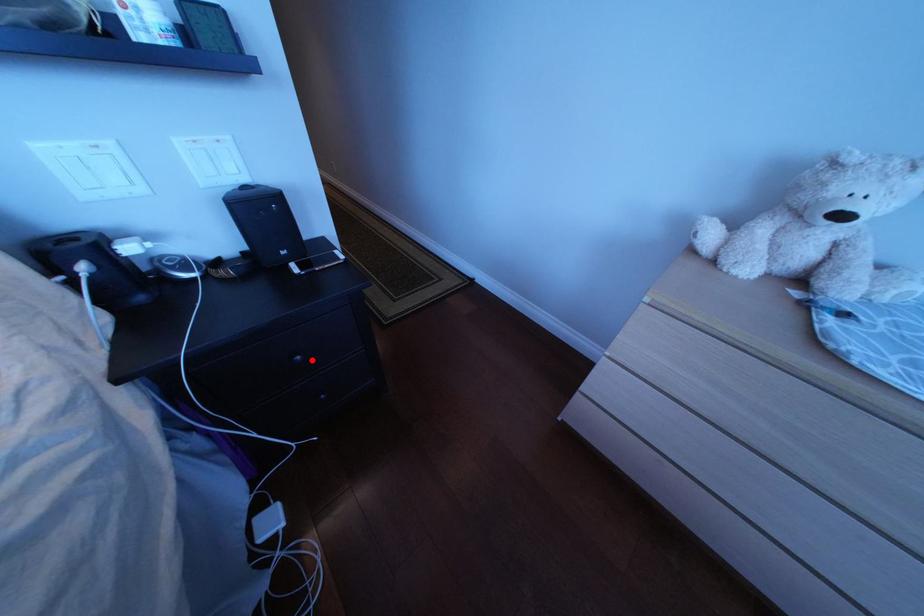
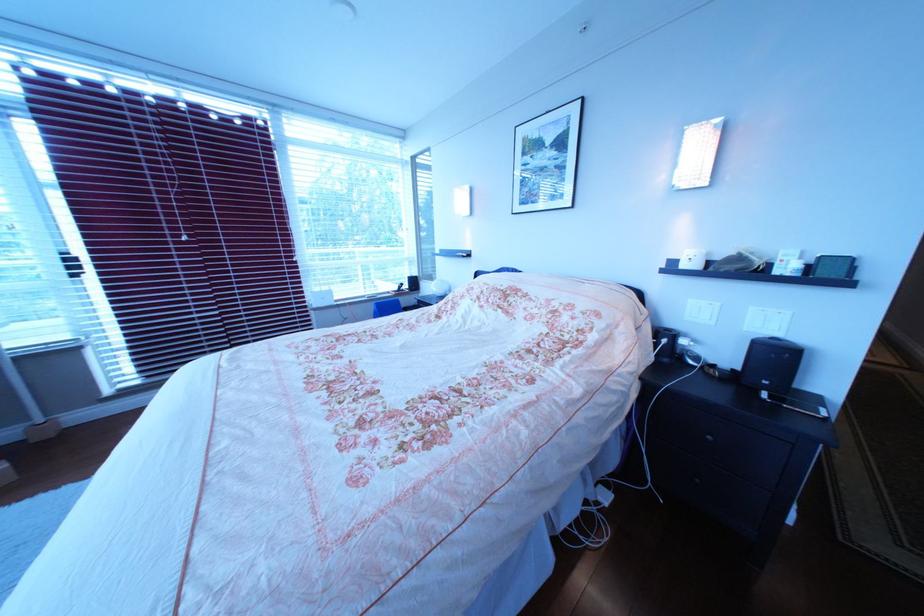
The point at the highlighted location is marked in the first image. Where is the corresponding point in the second image?

(725, 440)